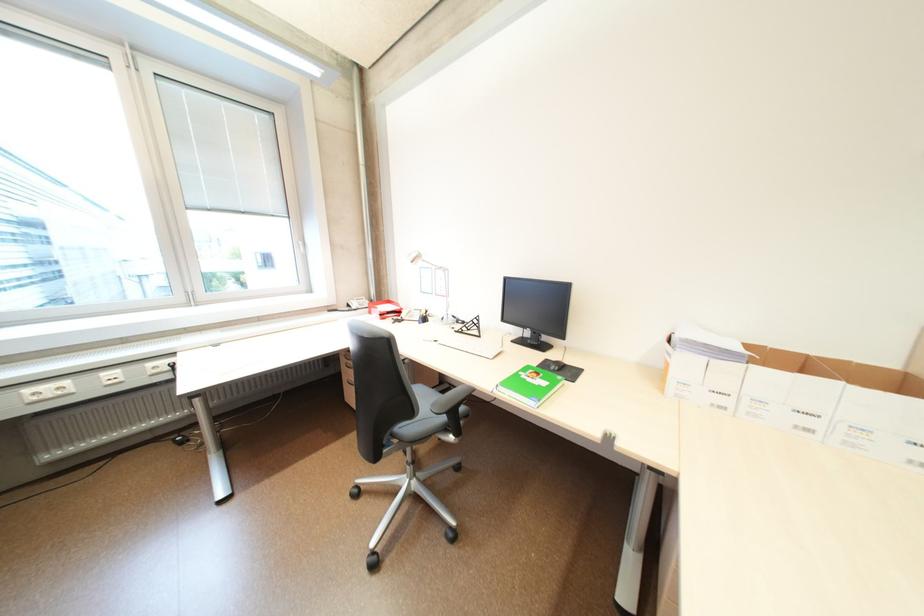
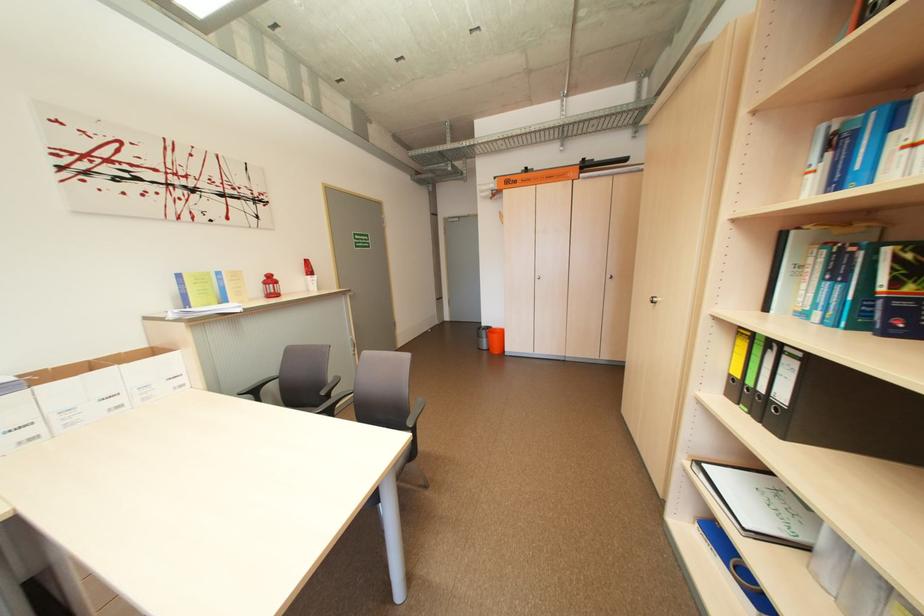
In the second image, find the point that corresponds to (x=761, y=362) in the first image.

(43, 384)